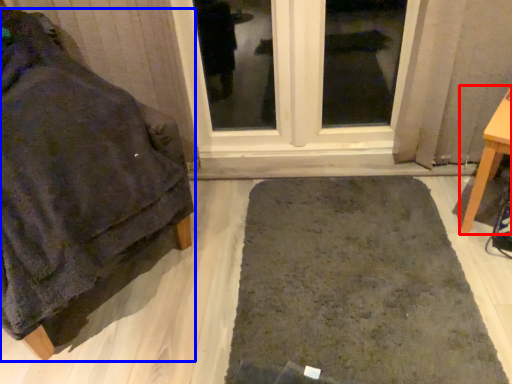
Question: Which object is closer to the camera taking this photo, furniture (highlighted by a red box) or furniture (highlighted by a blue box)?

Choices:
 (A) furniture
 (B) furniture

Answer: (B)